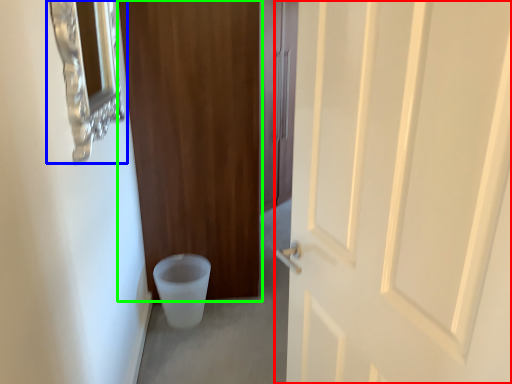
Question: Which object is positioned closest to door (highlighted by a red box)? Select from medicine cabinet (highlighted by a blue box) and door (highlighted by a green box).

Choices:
 (A) medicine cabinet
 (B) door

Answer: (A)